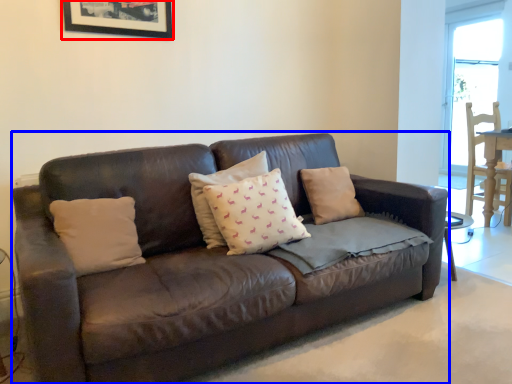
Question: Which object is closer to the camera taking this photo, picture frame (highlighted by a red box) or studio couch (highlighted by a blue box)?

Choices:
 (A) picture frame
 (B) studio couch

Answer: (B)